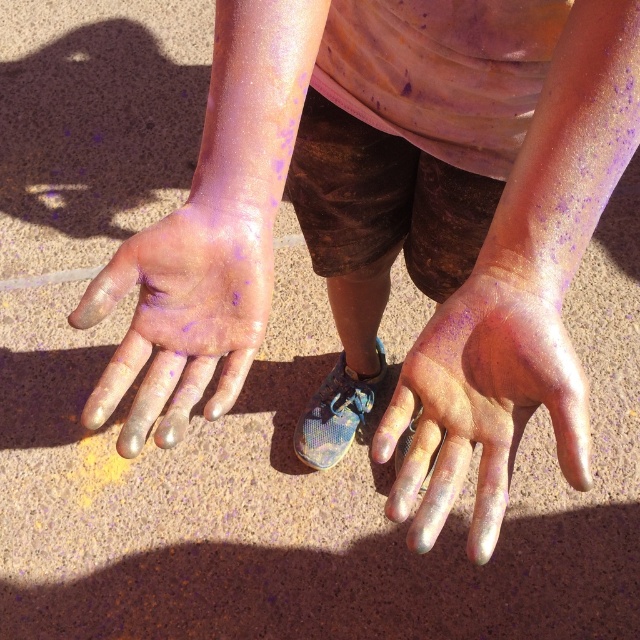
You are an artist creating a sculpture and need to know the size relationship between the iridescent metallic hand at center and the shiny metallic hand at center. Which one is larger?

The shiny metallic hand at center is larger than the iridescent metallic hand at center.

You are an artist trying to paint the scene. You notice two metallic hands at the center. Which hand should you paint first to create a sense of depth, the iridescent metallic hand at center or the shiny metallic hand at center?

You should paint the iridescent metallic hand at center first because it is in front of the shiny metallic hand at center, creating depth by layering the foreground element first.

In the scene shown: You are an artist observing the iridescent metallic hand at center and the shiny metallic hand at center in the image. Which hand appears taller?

The iridescent metallic hand at center appears taller than the shiny metallic hand at center according to the description.